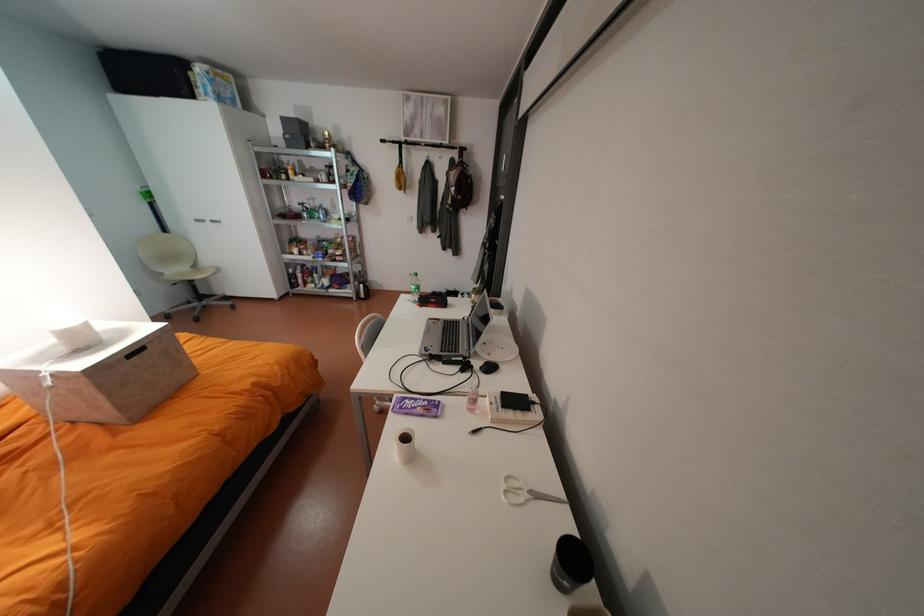
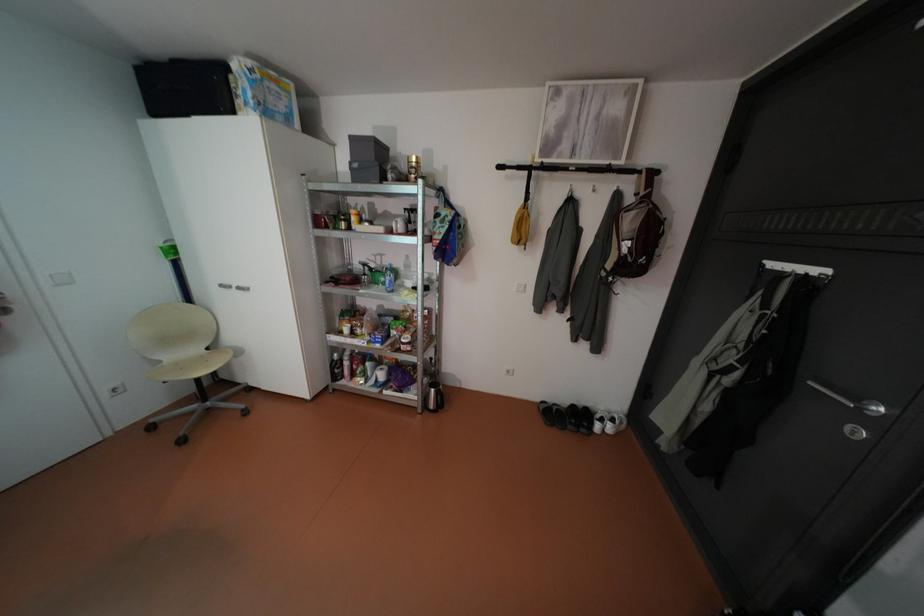
The point at [297,136] is marked in the first image. Where is the corresponding point in the second image?

(365, 164)